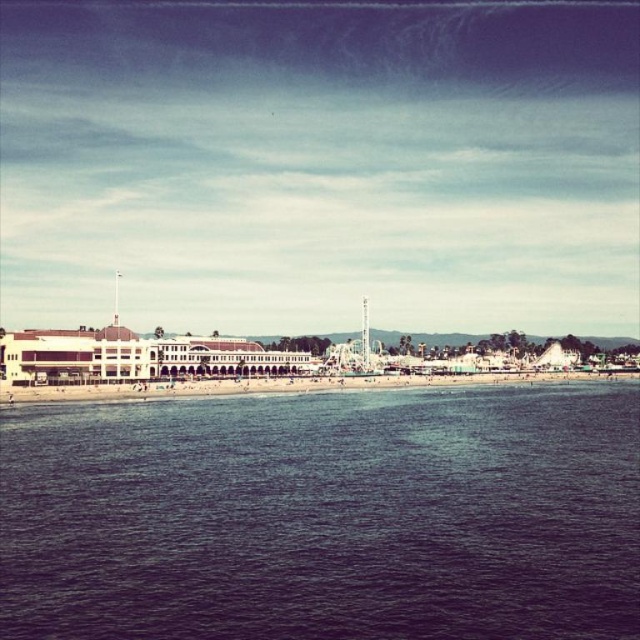
Question: Which point appears farthest from the camera in this image?

Choices:
 (A) (356, 364)
 (B) (106, 426)
 (C) (600, 372)

Answer: (C)

Question: Is the position of beach sand at lower center less distant than that of metallic amusement park ride at center?

Choices:
 (A) yes
 (B) no

Answer: (A)

Question: Where is blue water at lower center located in relation to beach sand at lower center in the image?

Choices:
 (A) left
 (B) right

Answer: (A)

Question: Which object appears closest to the camera in this image?

Choices:
 (A) blue water at lower center
 (B) beach sand at lower center
 (C) metallic amusement park ride at center

Answer: (A)

Question: Is beach sand at lower center thinner than metallic amusement park ride at center?

Choices:
 (A) no
 (B) yes

Answer: (A)

Question: Which point appears closest to the camera in this image?

Choices:
 (A) (349, 371)
 (B) (160, 563)

Answer: (B)